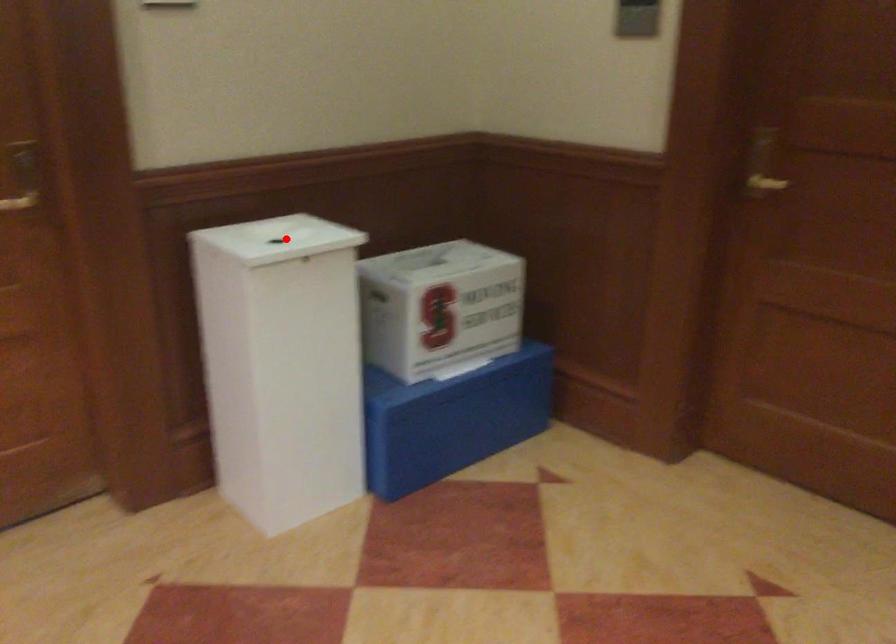
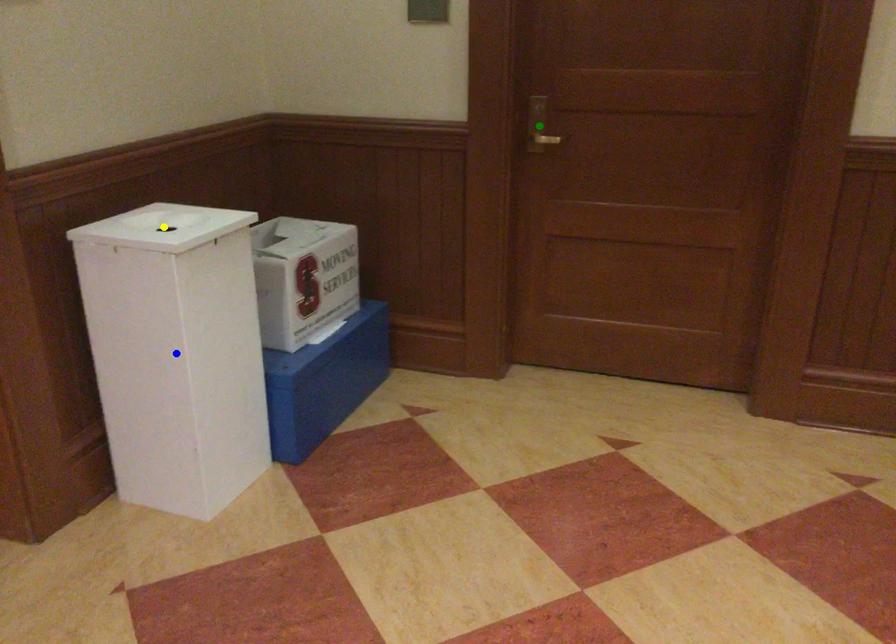
Question: I am providing you with two images of the same scene from different viewpoints. A red point is marked on the first image. You are given multiple points on the second image. Which point in image 2 is actually the same real-world point as the red point in image 1?

Choices:
 (A) blue point
 (B) yellow point
 (C) green point

Answer: (B)